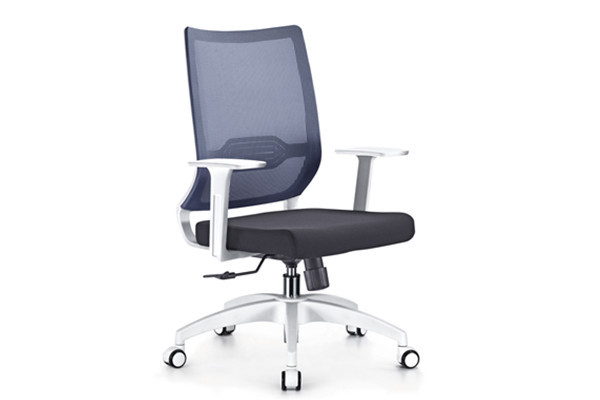
Find the location of a particular element. 1 office chair is located at coordinates (269, 126).